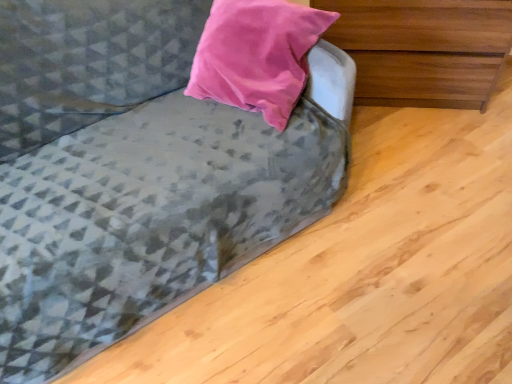
Question: Does wooden chest of drawers at upper right have a greater height compared to textured gray fabric couch at upper left?

Choices:
 (A) no
 (B) yes

Answer: (A)

Question: From the image's perspective, is wooden chest of drawers at upper right located above textured gray fabric couch at upper left?

Choices:
 (A) yes
 (B) no

Answer: (A)

Question: From a real-world perspective, does wooden chest of drawers at upper right stand above textured gray fabric couch at upper left?

Choices:
 (A) yes
 (B) no

Answer: (B)

Question: Is wooden chest of drawers at upper right not within textured gray fabric couch at upper left?

Choices:
 (A) yes
 (B) no

Answer: (A)

Question: Is wooden chest of drawers at upper right next to textured gray fabric couch at upper left?

Choices:
 (A) no
 (B) yes

Answer: (A)

Question: Is wooden chest of drawers at upper right facing away from textured gray fabric couch at upper left?

Choices:
 (A) no
 (B) yes

Answer: (A)

Question: Can you confirm if textured gray fabric couch at upper left is positioned to the right of wooden chest of drawers at upper right?

Choices:
 (A) no
 (B) yes

Answer: (A)

Question: Is the position of textured gray fabric couch at upper left less distant than that of wooden chest of drawers at upper right?

Choices:
 (A) yes
 (B) no

Answer: (A)

Question: Would you say textured gray fabric couch at upper left is outside wooden chest of drawers at upper right?

Choices:
 (A) no
 (B) yes

Answer: (B)

Question: Considering the relative sizes of textured gray fabric couch at upper left and wooden chest of drawers at upper right in the image provided, is textured gray fabric couch at upper left shorter than wooden chest of drawers at upper right?

Choices:
 (A) no
 (B) yes

Answer: (A)

Question: Is textured gray fabric couch at upper left touching wooden chest of drawers at upper right?

Choices:
 (A) no
 (B) yes

Answer: (A)

Question: Considering the relative positions of textured gray fabric couch at upper left and wooden chest of drawers at upper right in the image provided, is textured gray fabric couch at upper left to the left of wooden chest of drawers at upper right from the viewer's perspective?

Choices:
 (A) no
 (B) yes

Answer: (B)

Question: Is wooden chest of drawers at upper right in front of or behind textured gray fabric couch at upper left in the image?

Choices:
 (A) behind
 (B) front

Answer: (A)